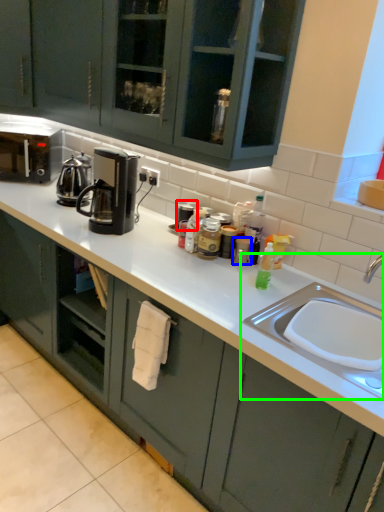
Question: Which is nearer to the appliance (highlighted by a red box)? appliance (highlighted by a blue box) or sink (highlighted by a green box).

Choices:
 (A) appliance
 (B) sink

Answer: (A)